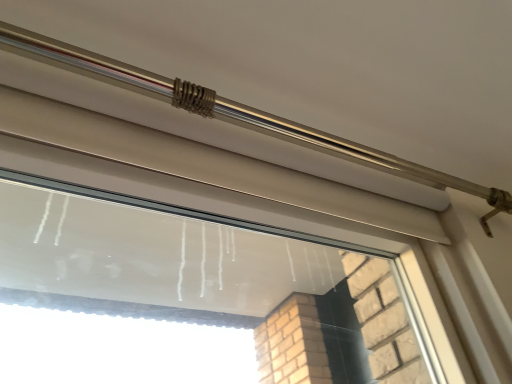
Find the location of a particular element. metallic at upper center is located at coordinates (230, 111).

Describe the element at coordinates (230, 111) in the screenshot. This screenshot has height=384, width=512. I see `metallic at upper center` at that location.

Locate an element on the screen. metallic at upper center is located at coordinates (230, 111).